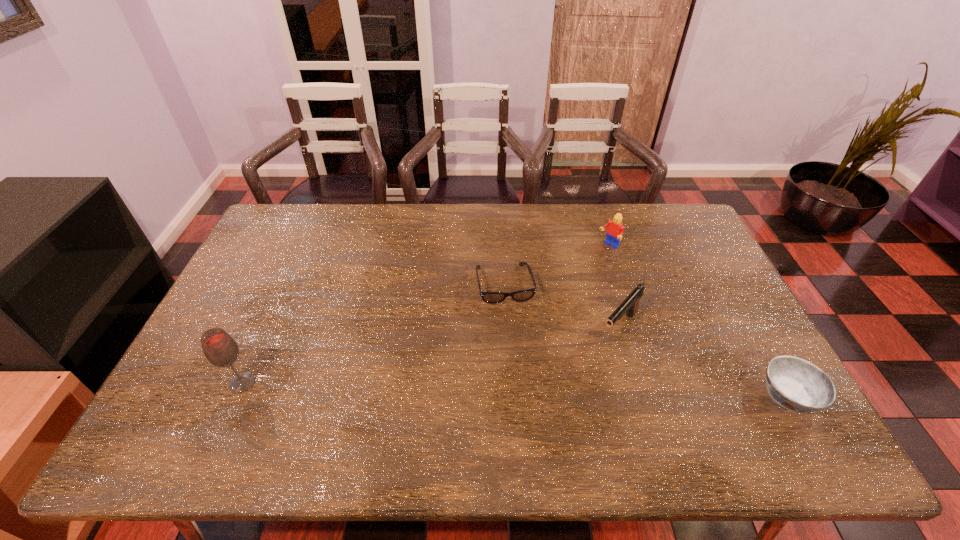
Where is `vacant space situated on the lenses of the second object from left to right`? The width and height of the screenshot is (960, 540). vacant space situated on the lenses of the second object from left to right is located at coordinates (527, 401).

You are a GUI agent. You are given a task and a screenshot of the screen. Output one action in this format:
    pyautogui.click(x=<x>, y=<y>)
    Task: Click on the vacant space located 0.320m on the front-facing side of the Lego
    
    Given the screenshot: What is the action you would take?
    pyautogui.click(x=545, y=300)

At what (x,y) coordinates should I click in order to perform the action: click on vacant area situated on the front-facing side of the Lego. Please return your answer as a coordinate pair (x, y). Looking at the image, I should click on (531, 313).

At what (x,y) coordinates should I click in order to perform the action: click on free space located on the front-facing side of the Lego. Please return your answer as a coordinate pair (x, y). This screenshot has height=540, width=960. Looking at the image, I should click on (564, 285).

At what (x,y) coordinates should I click in order to perform the action: click on vacant space situated at the muzzle of the pistol. Please return your answer as a coordinate pair (x, y). The height and width of the screenshot is (540, 960). Looking at the image, I should click on (595, 357).

You are a GUI agent. You are given a task and a screenshot of the screen. Output one action in this format:
    pyautogui.click(x=<x>, y=<y>)
    Task: Click on the free point located 0.100m at the muzzle of the pistol
    The width and height of the screenshot is (960, 540).
    Given the screenshot: What is the action you would take?
    pyautogui.click(x=588, y=366)

This screenshot has height=540, width=960. Identify the location of free region located at the muzzle of the pistol. (589, 364).

The width and height of the screenshot is (960, 540). In order to click on object present at the far edge in this screenshot , I will do `click(614, 232)`.

The height and width of the screenshot is (540, 960). I want to click on glass drink container that is positioned at the near edge, so click(220, 349).

This screenshot has height=540, width=960. Find the location of `ashtray positioned at the near edge`. ashtray positioned at the near edge is located at coordinates (794, 383).